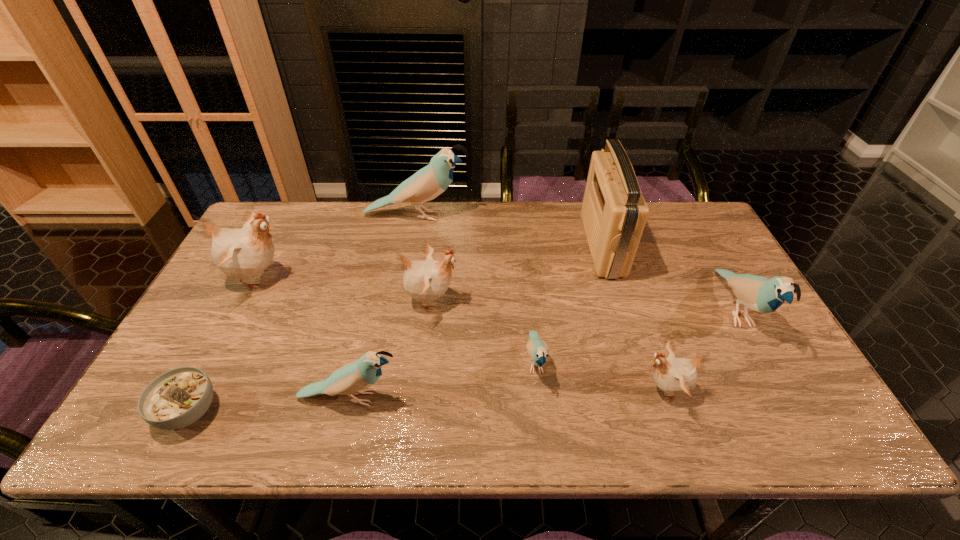
You are a GUI agent. You are given a task and a screenshot of the screen. Output one action in this format:
    pyautogui.click(x=<x>, y=<y>)
    Task: Click on the sixth bird from left to right
    This screenshot has height=540, width=960.
    Given the screenshot: What is the action you would take?
    pyautogui.click(x=676, y=376)

Identify the location of the smallest blue bird. (538, 350).

Find the location of a particular element. Image resolution: width=960 pixels, height=540 pixels. the third bird from right to left is located at coordinates click(x=538, y=350).

You are a GUI agent. You are given a task and a screenshot of the screen. Output one action in this format:
    pyautogui.click(x=<x>, y=<y>)
    Task: Click on the soup bowl
    This screenshot has width=960, height=540.
    Given the screenshot: What is the action you would take?
    pyautogui.click(x=179, y=397)

Locate an element on the screen. Image resolution: width=960 pixels, height=540 pixels. the shortest object is located at coordinates tap(179, 397).

Where is `vacant region located 0.170m on the front-facing side of the radio receiver`? Image resolution: width=960 pixels, height=540 pixels. vacant region located 0.170m on the front-facing side of the radio receiver is located at coordinates (533, 245).

Identify the location of free space located on the front-facing side of the radio receiver. (489, 245).

You are a GUI agent. You are given a task and a screenshot of the screen. Output one action in this format:
    pyautogui.click(x=<x>, y=<y>)
    Task: Click on the vacant area situated on the front-facing side of the radio receiver
    Image resolution: width=960 pixels, height=540 pixels.
    Given the screenshot: What is the action you would take?
    pyautogui.click(x=567, y=245)

Find the location of a particular element. vacant region located 0.140m at the face of the biggest blue bird is located at coordinates (510, 216).

The image size is (960, 540). What are the coordinates of `free spot located 0.390m at the beak of the leftmost white bird` in the screenshot? It's located at (426, 278).